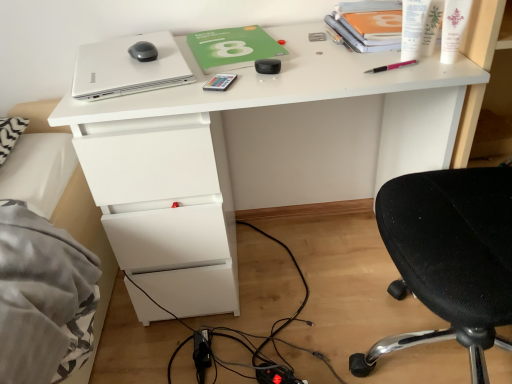
This screenshot has height=384, width=512. I want to click on free space to the left of white paper towel at upper right, which appears as the first stationery when viewed from the right, so (352, 59).